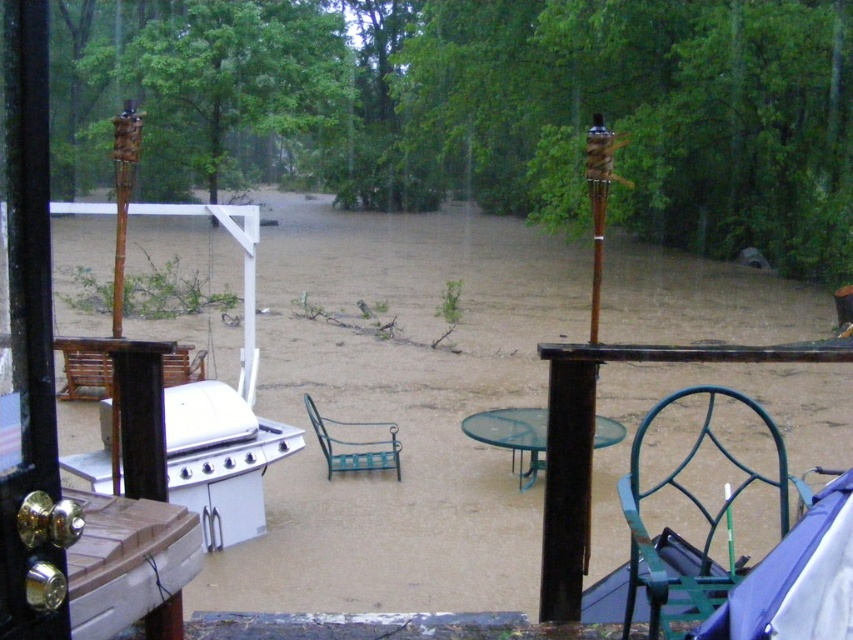
You are a lifeguard trying to reach a person floating in the water between the white glossy grill at lower left and the green wire chair at lower right. Given that the distance between these two objects is 3.65 meters, can you safely swim to the person if you have a 3.5 meter long rescue rope?

The distance between the white glossy grill at lower left and the green wire chair at lower right is 3.65 meters. Since the rescue rope is only 3.5 meters long, it is not long enough to reach the person floating between them. You would need a longer rope or another method to safely reach the person.

You are a lifeguard trying to reach a person floating in the water near the blue fabric umbrella at lower right. You are currently standing next to the green wire chair at lower right. Which direction should you move to reach the umbrella first?

The blue fabric umbrella at lower right is behind the green wire chair at lower right, so you should move backward to reach the blue fabric umbrella at lower right first.

You are a flood relief volunteer trying to assess the safety of moving an object from the green wire chair at lower right to the blue fabric umbrella at lower right. Which object is closer to the center of the flooded area?

The green wire chair at lower right is positioned on the right side of the blue fabric umbrella at lower right, so the blue fabric umbrella at lower right is closer to the center of the flooded area.